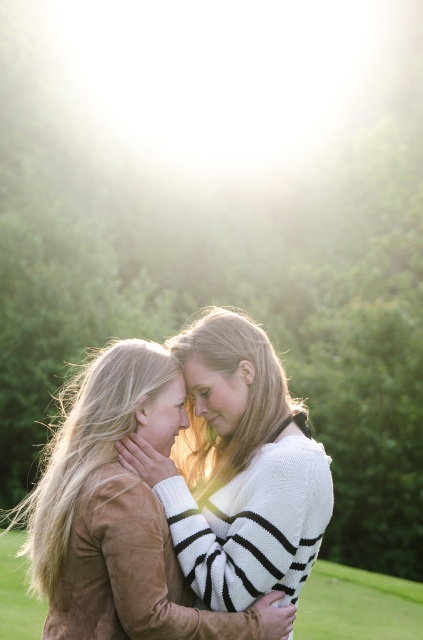
You are a photographer trying to capture the scene with a camera. You want to focus on the suede brown jacket at center. Where should you aim your camera to ensure it is in the frame?

The suede brown jacket at center is located at point 0.808 on the x axis and 0.284 on the y axis, so aim your camera at those coordinates to capture it in the frame.

You are a photographer setting up a shot in this scene. You want to place a small reflector to the right of the green grass at lower right to bounce light onto the subjects. Will the suede brown jacket at center block the reflector from being placed there?

The suede brown jacket at center is positioned on the left side of green grass at lower right, so placing the reflector to the right of the green grass at lower right would not be blocked by the jacket.

You are standing at the point labeled point (125, 550) in the image. You want to take a photo of the two people in the background. Since you are 3.01 meters away from the point, will you be able to capture both individuals in a single frame without moving?

Yes, because the distance of 3.01 meters from the point allows the camera to capture both individuals in the background within a single frame without needing to move.